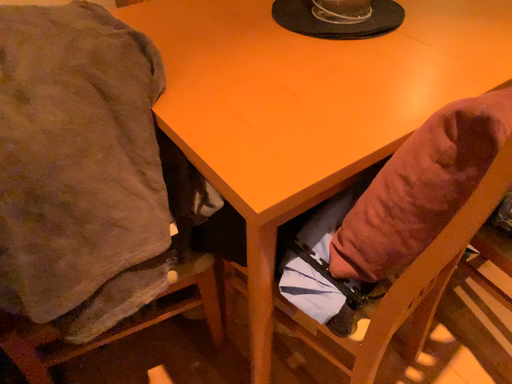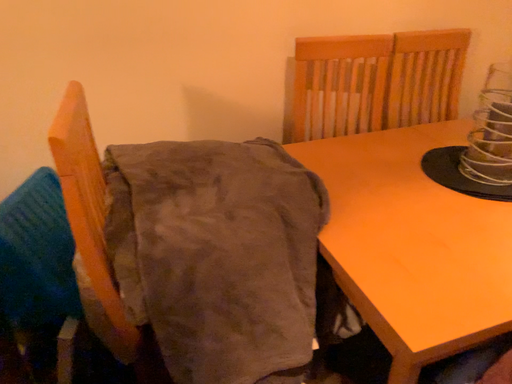
Question: Which way did the camera rotate in the video?

Choices:
 (A) rotated left
 (B) rotated right

Answer: (A)